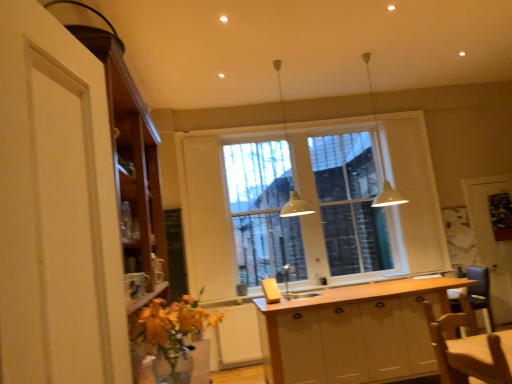
Question: Considering the relative sizes of wooden screen door at right, the 1th screen door when ordered from right to left, and white matte screen door at center, which is the first screen door in left-to-right order, in the image provided, is wooden screen door at right, the 1th screen door when ordered from right to left, bigger than white matte screen door at center, which is the first screen door in left-to-right order,?

Choices:
 (A) yes
 (B) no

Answer: (A)

Question: Is wooden screen door at right, the second screen door when ordered from front to back, outside white matte screen door at center, the 2th screen door from the back?

Choices:
 (A) yes
 (B) no

Answer: (A)

Question: Is wooden screen door at right, which appears as the 2th screen door when viewed from the left, taller than white matte screen door at center, acting as the 1th screen door starting from the front?

Choices:
 (A) no
 (B) yes

Answer: (A)

Question: Considering the relative positions of wooden screen door at right, which appears as the 2th screen door when viewed from the left, and white matte screen door at center, acting as the 1th screen door starting from the front, in the image provided, is wooden screen door at right, which appears as the 2th screen door when viewed from the left, to the left of white matte screen door at center, acting as the 1th screen door starting from the front, from the viewer's perspective?

Choices:
 (A) yes
 (B) no

Answer: (B)

Question: Are wooden screen door at right, the 1th screen door when ordered from right to left, and white matte screen door at center, the 2th screen door from the back, making contact?

Choices:
 (A) no
 (B) yes

Answer: (A)

Question: Is wooden screen door at right, which appears as the 2th screen door when viewed from the left, looking in the opposite direction of white matte screen door at center, the 2th screen door from the back?

Choices:
 (A) yes
 (B) no

Answer: (B)

Question: Is wooden chair at lower right wider than wooden cabinet at left, the first cabinetry positioned from the left?

Choices:
 (A) yes
 (B) no

Answer: (B)

Question: Is wooden chair at lower right aimed at wooden cabinet at left, which ranks as the 2th cabinetry in right-to-left order?

Choices:
 (A) no
 (B) yes

Answer: (A)

Question: Is wooden chair at lower right taller than wooden cabinet at left, the first cabinetry positioned from the left?

Choices:
 (A) no
 (B) yes

Answer: (A)

Question: Can we say wooden chair at lower right lies outside wooden cabinet at left, the second cabinetry in the back-to-front sequence?

Choices:
 (A) yes
 (B) no

Answer: (A)

Question: Is wooden chair at lower right smaller than wooden cabinet at left, the first cabinetry positioned from the left?

Choices:
 (A) yes
 (B) no

Answer: (A)

Question: From a real-world perspective, is wooden chair at lower right positioned over wooden cabinet at left, the first cabinetry positioned from the left, based on gravity?

Choices:
 (A) no
 (B) yes

Answer: (A)

Question: Is wooden screen door at right, the 1th screen door when ordered from right to left, bigger than wooden cabinet at left, which is the 1th cabinetry from front to back?

Choices:
 (A) yes
 (B) no

Answer: (B)